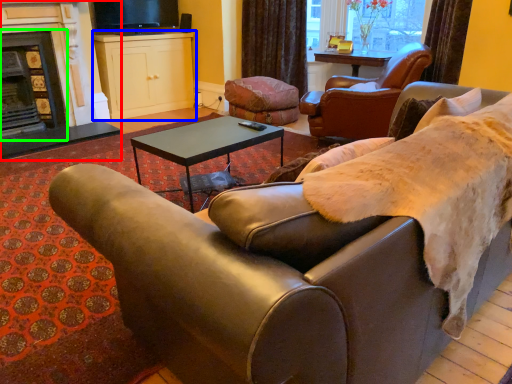
Question: Considering the real-world distances, which object is farthest from fireplace (highlighted by a red box)? cabinetry (highlighted by a blue box) or fireplace (highlighted by a green box)?

Choices:
 (A) cabinetry
 (B) fireplace

Answer: (A)